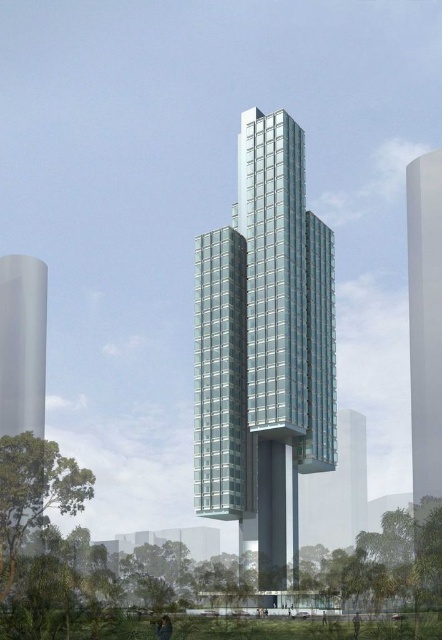
You are an architect designing a new city park between the white glossy tower at right and the transparent glass tower at left. Which tower should the park be closer to if you want it to be closer to the taller structure?

The park should be closer to the white glossy tower at right because it is taller than the transparent glass tower at left.

You are a drone operator trying to navigate between two points in the image. The first point is point (415, 195) and the second point is point (19, 378). Which point is closer to your camera?

Point (19, 378) is closer to the camera because it is less further than point (415, 195).

You are a city planner reviewing the architectural design. You need to determine which tower is the taller one between the clear glass tower at center and the white glossy tower at right. Based on the provided information, which one is taller?

The clear glass tower at center is taller than the white glossy tower at right according to the description.